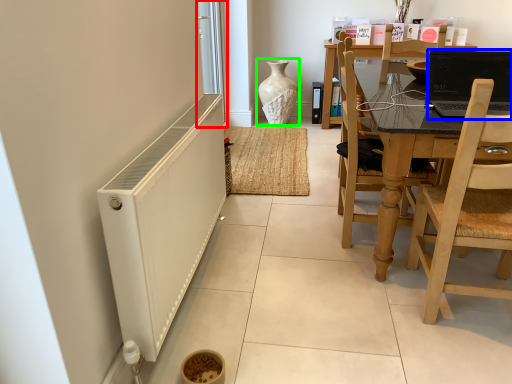
Question: Considering the real-world distances, which object is farthest from screen door (highlighted by a red box)? laptop (highlighted by a blue box) or vase (highlighted by a green box)?

Choices:
 (A) laptop
 (B) vase

Answer: (A)